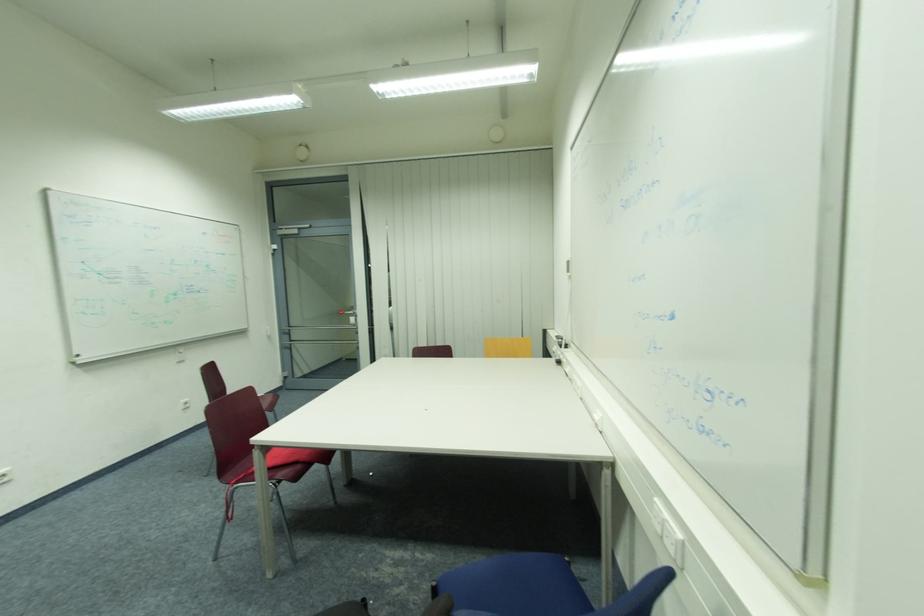
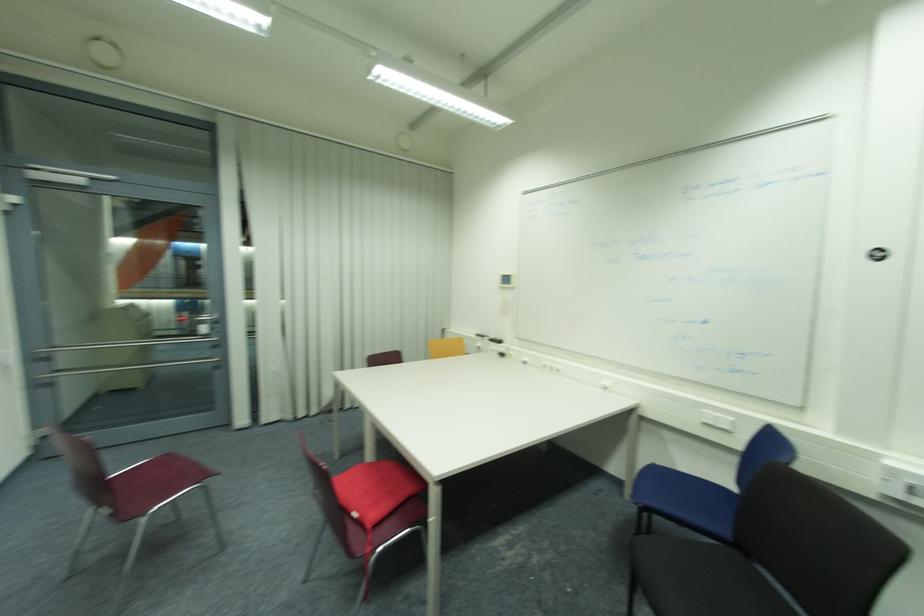
Find the pixel in the second image that matches [359,321] in the first image.

(217, 330)